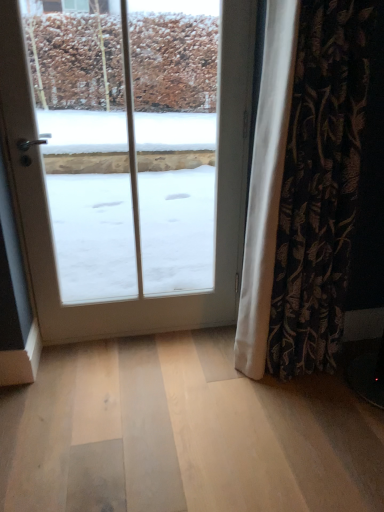
At what (x,y) coordinates should I click in order to perform the action: click on vacant space positioned to the left of black floral fabric curtain at right. Please return your answer as a coordinate pair (x, y). The height and width of the screenshot is (512, 384). Looking at the image, I should click on (199, 390).